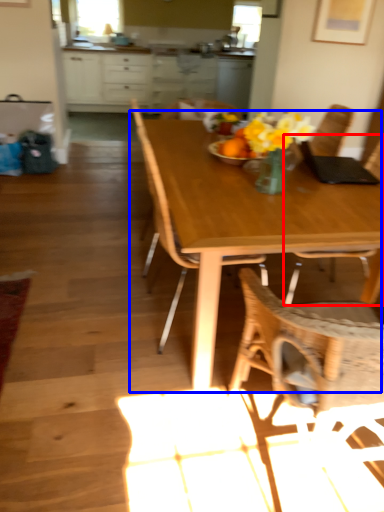
Question: Among these objects, which one is nearest to the camera, chair (highlighted by a red box) or kitchen & dining room table (highlighted by a blue box)?

Choices:
 (A) chair
 (B) kitchen & dining room table

Answer: (B)